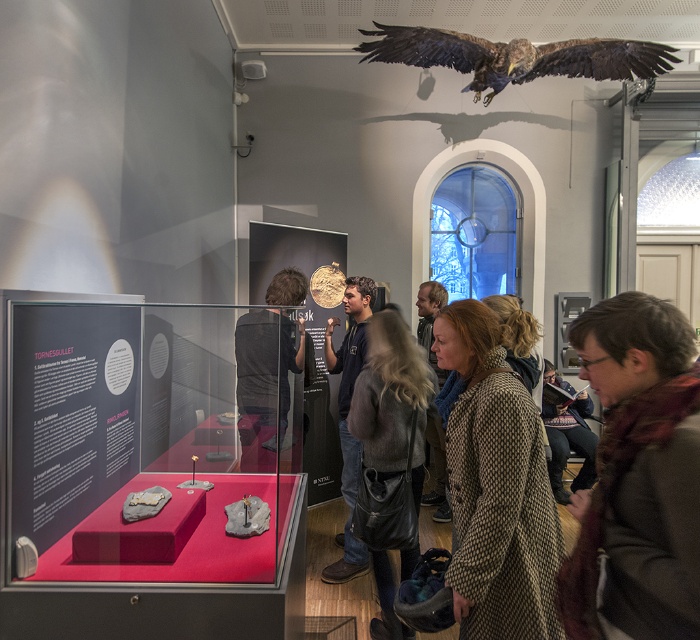
Is dark blue jeans at center further to the viewer compared to brown wool coat at center?

No.

Does point (350, 445) lie in front of point (424, 292)?

Yes, it is in front of point (424, 292).

Is point (343, 540) farther from camera compared to point (444, 520)?

That is False.

The image size is (700, 640). Identify the location of dark blue jeans at center. (344, 417).

Is point (659, 556) farther from viewer compared to point (368, 458)?

No, (659, 556) is in front of (368, 458).

Who is taller, brown wool scarf at lower right or leather jacket at center?

Standing taller between the two is leather jacket at center.

You are a GUI agent. You are given a task and a screenshot of the screen. Output one action in this format:
    pyautogui.click(x=<x>, y=<y>)
    Task: Click on the brown wool scarf at lower right
    This screenshot has height=640, width=700.
    Given the screenshot: What is the action you would take?
    pyautogui.click(x=638, y=474)

Which is below, brown leather jacket at lower right or brown wool coat at center?

brown wool coat at center is below.

Is brown leather jacket at lower right positioned in front of brown wool coat at center?

Yes, it is in front of brown wool coat at center.

Find the location of a particular element. Image resolution: width=700 pixels, height=640 pixels. brown leather jacket at lower right is located at coordinates (567, 435).